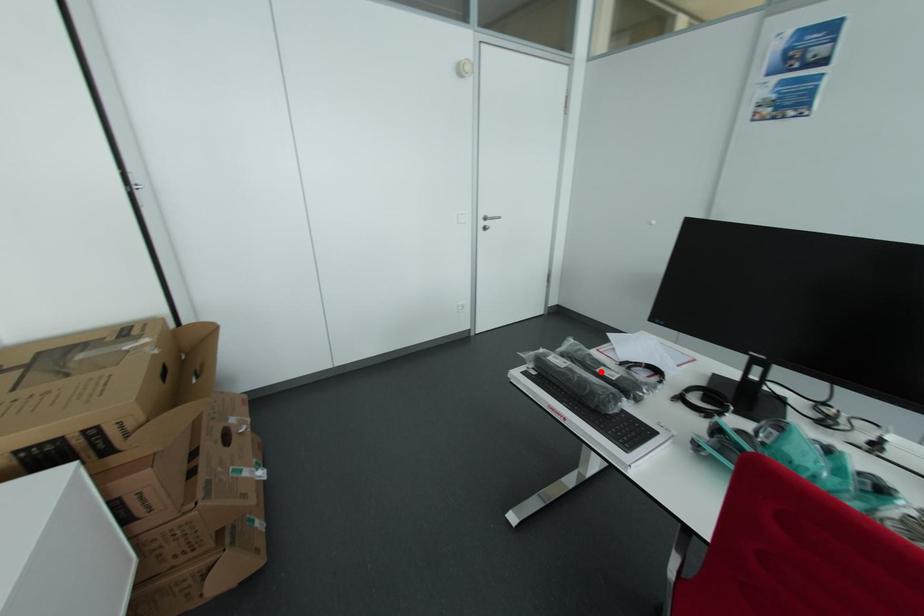
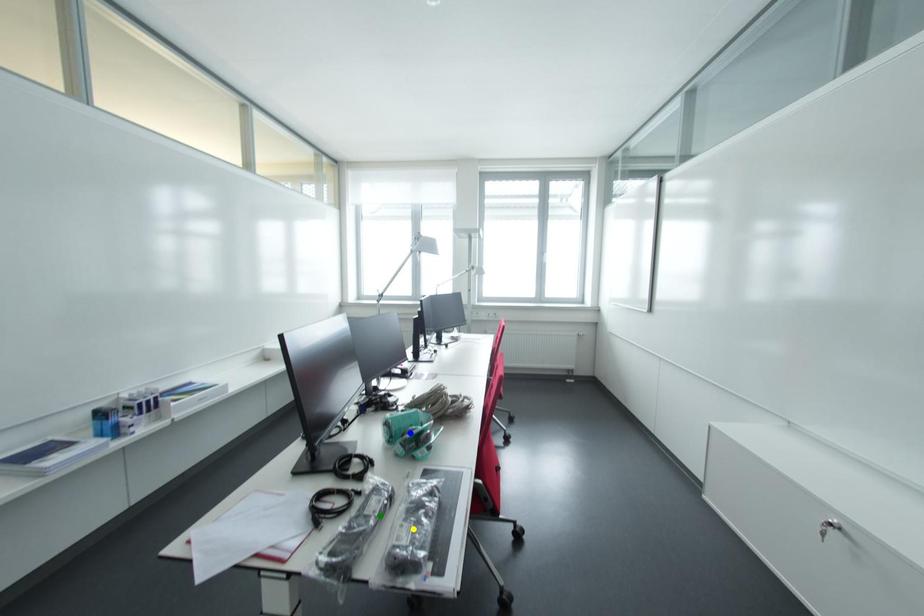
Question: I am providing you with two images of the same scene from different viewpoints. A red point is marked on the first image. You are given multiple points on the second image. Can you choose the point in image 2 that corresponds to the point in image 1?

Choices:
 (A) yellow point
 (B) blue point
 (C) green point

Answer: (C)